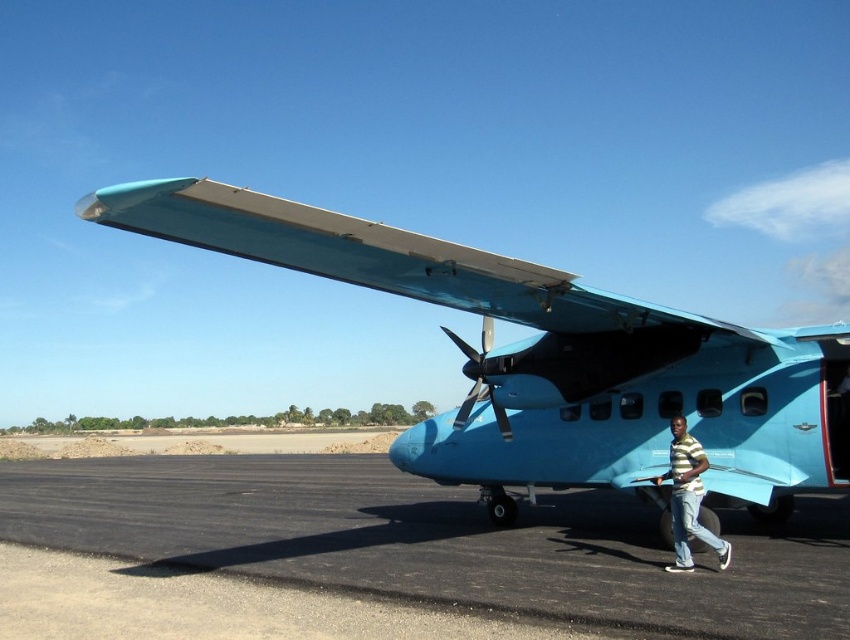
Based on the photo, you are a pilot standing at the back of the black asphalt runway at lower center. You need to walk to the metallic silver propeller at center. Which direction should you walk to reach it?

The metallic silver propeller at center is located in the front of the black asphalt runway at lower center. So you should walk forward to reach the metallic silver propeller at center.

You are a pilot standing at the origin point of the tarmac. You need to locate the light blue matte airplane at center. According to the coordinates provided, where should you look?

The light blue matte airplane at center is located at coordinates point (551, 358), so you should look towards that point to find it.